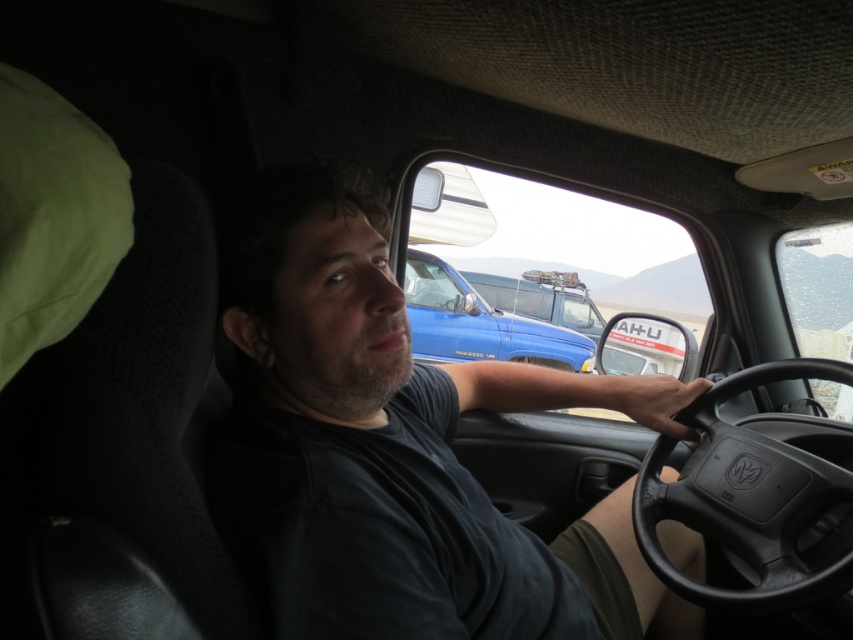
Question: Which point is farther to the camera?

Choices:
 (A) (476, 285)
 (B) (236, 552)
 (C) (770, 442)

Answer: (A)

Question: Can you confirm if dark gray shirt at center is smaller than black leather steering wheel at center?

Choices:
 (A) no
 (B) yes

Answer: (A)

Question: Can you confirm if dark gray shirt at center is positioned below matte blue truck at center?

Choices:
 (A) no
 (B) yes

Answer: (B)

Question: Which object is farther from the camera taking this photo?

Choices:
 (A) black leather steering wheel at center
 (B) matte blue truck at center

Answer: (B)

Question: Can you confirm if dark gray shirt at center is positioned above black leather steering wheel at center?

Choices:
 (A) no
 (B) yes

Answer: (B)

Question: Which of these objects is positioned closest to the dark gray shirt at center?

Choices:
 (A) black leather steering wheel at center
 (B) matte blue truck at center

Answer: (A)